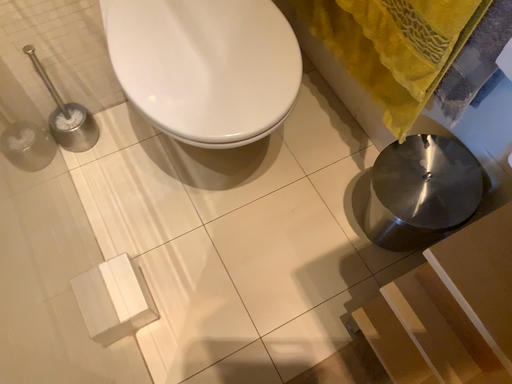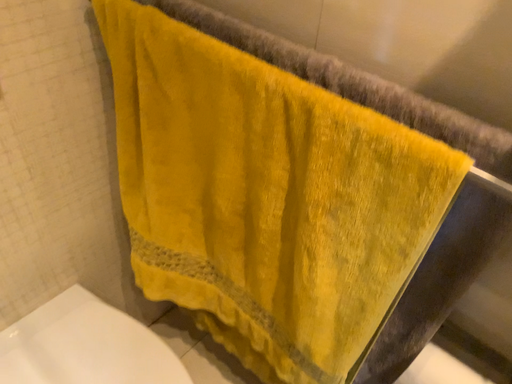
Question: Which way did the camera rotate in the video?

Choices:
 (A) rotated left
 (B) rotated right

Answer: (B)